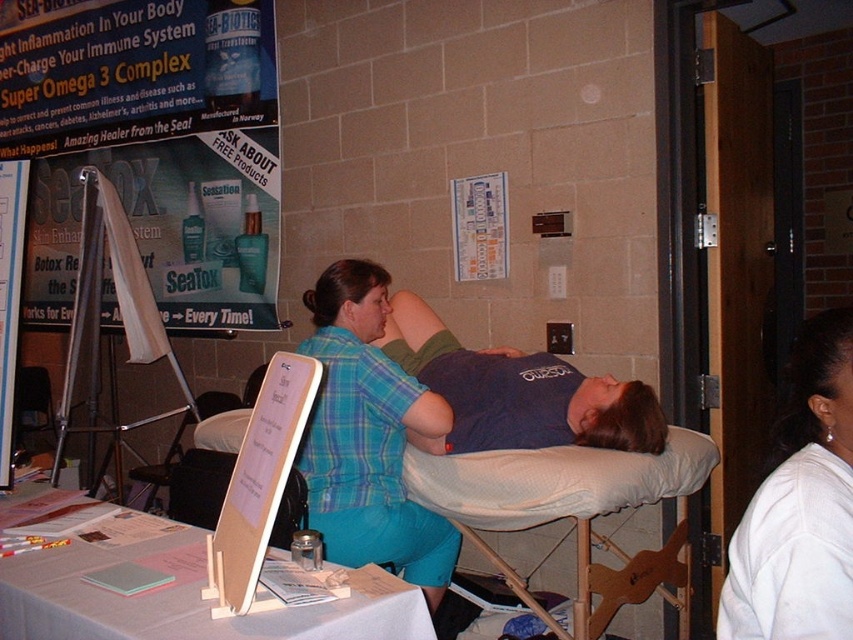
Does plaid shirt at center appear over white paper at center?

Correct, plaid shirt at center is located above white paper at center.

Who is lower down, plaid shirt at center or white paper at center?

white paper at center is lower down.

Between point (363, 442) and point (418, 595), which one is positioned behind?

Point (363, 442)

In order to click on plaid shirt at center in this screenshot , I will do `click(368, 436)`.

Is point (143, 593) closer to camera compared to point (173, 445)?

Yes.

Is point (164, 609) positioned before point (206, 396)?

Yes, point (164, 609) is closer to viewer.

Where is `white paper at center`? white paper at center is located at coordinates (177, 596).

Locate an element on the screen. This screenshot has width=853, height=640. matte plastic poster at upper left is located at coordinates (148, 145).

Consider the image. Can you confirm if matte plastic poster at upper left is taller than plaid shirt at center?

Yes.

Measure the distance between point (x=152, y=109) and camera.

Point (x=152, y=109) and camera are 4.24 meters apart from each other.

Where is `matte plastic poster at upper left`? This screenshot has height=640, width=853. matte plastic poster at upper left is located at coordinates (148, 145).